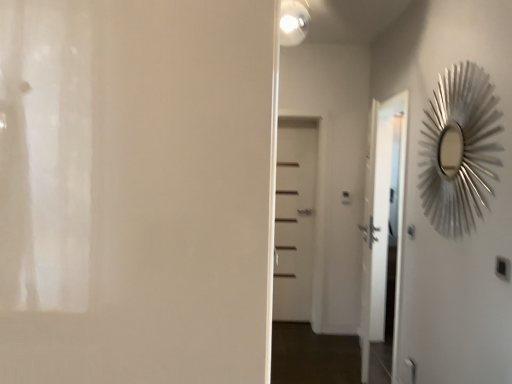
Locate an element on the screen. The height and width of the screenshot is (384, 512). white matte door at center, placed as the 1th door when sorted from right to left is located at coordinates (294, 219).

The width and height of the screenshot is (512, 384). Describe the element at coordinates (136, 190) in the screenshot. I see `white matte door at center, the second door viewed from the right` at that location.

Locate an element on the screen. The width and height of the screenshot is (512, 384). white glossy light fixture at upper center is located at coordinates (293, 22).

Where is `black plastic light switch at lower right`? black plastic light switch at lower right is located at coordinates (502, 268).

Can you confirm if silver metallic sunburst mirror at upper right is taller than white matte door at center, the first door positioned from the back?

No, silver metallic sunburst mirror at upper right is not taller than white matte door at center, the first door positioned from the back.

Could you tell me if silver metallic sunburst mirror at upper right is turned towards white matte door at center, which is counted as the 2th door, starting from the left?

No, silver metallic sunburst mirror at upper right is not oriented towards white matte door at center, which is counted as the 2th door, starting from the left.

Would you consider silver metallic sunburst mirror at upper right to be distant from white matte door at center, placed as the 1th door when sorted from right to left?

Indeed, silver metallic sunburst mirror at upper right is not near white matte door at center, placed as the 1th door when sorted from right to left.

Choose the correct answer: Is silver metallic sunburst mirror at upper right inside white matte door at center, which is counted as the 2th door, starting from the left, or outside it?

silver metallic sunburst mirror at upper right is spatially situated outside white matte door at center, which is counted as the 2th door, starting from the left.

Is silver metallic sunburst mirror at upper right outside of silver metallic sunburst mirror at right?

silver metallic sunburst mirror at upper right lies outside silver metallic sunburst mirror at right's area.

Is silver metallic sunburst mirror at upper right smaller than silver metallic sunburst mirror at right?

Correct, silver metallic sunburst mirror at upper right occupies less space than silver metallic sunburst mirror at right.

Is point (467, 209) farther from camera compared to point (369, 273)?

No.

Is silver metallic sunburst mirror at upper right next to silver metallic sunburst mirror at right?

No, silver metallic sunburst mirror at upper right is not with silver metallic sunburst mirror at right.

Considering the relative sizes of black plastic light switch at lower right and white glossy light fixture at upper center in the image provided, is black plastic light switch at lower right bigger than white glossy light fixture at upper center?

No.

Is point (498, 274) positioned in front of point (293, 21)?

Yes.

Is black plastic light switch at lower right next to white glossy light fixture at upper center and touching it?

No, black plastic light switch at lower right is not next to white glossy light fixture at upper center.

Is black plastic light switch at lower right turned away from white glossy light fixture at upper center?

black plastic light switch at lower right is not turned away from white glossy light fixture at upper center.

Is silver metallic sunburst mirror at upper right thinner than black plastic light switch at lower right?

No, silver metallic sunburst mirror at upper right is not thinner than black plastic light switch at lower right.

Is silver metallic sunburst mirror at upper right bigger than black plastic light switch at lower right?

Correct, silver metallic sunburst mirror at upper right is larger in size than black plastic light switch at lower right.

From a real-world perspective, is silver metallic sunburst mirror at upper right beneath black plastic light switch at lower right?

No, from a real-world perspective, silver metallic sunburst mirror at upper right is not below black plastic light switch at lower right.

Starting from the silver metallic sunburst mirror at upper right, which door is the 2nd one to the left? Please provide its 2D coordinates.

[(136, 190)]

Measure the distance from silver metallic sunburst mirror at upper right to white matte door at center, positioned as the 2th door in back-to-front order.

6.69 feet.

Which is closer, (x=450, y=117) or (x=166, y=162)?

Point (x=450, y=117) is positioned farther from the camera compared to point (x=166, y=162).

From the image's perspective, between silver metallic sunburst mirror at upper right and white matte door at center, positioned as the 1th door in front-to-back order, who is located below?

white matte door at center, positioned as the 1th door in front-to-back order, from the image's perspective.

Is white matte door at center, the first door positioned from the back, inside the boundaries of white glossy light fixture at upper center, or outside?

white matte door at center, the first door positioned from the back, cannot be found inside white glossy light fixture at upper center.

Considering the relative sizes of white matte door at center, which is counted as the 2th door, starting from the left, and white glossy light fixture at upper center in the image provided, is white matte door at center, which is counted as the 2th door, starting from the left, thinner than white glossy light fixture at upper center?

Indeed, white matte door at center, which is counted as the 2th door, starting from the left, has a lesser width compared to white glossy light fixture at upper center.

Between white matte door at center, placed as the 1th door when sorted from right to left, and white glossy light fixture at upper center, which one appears on the right side from the viewer's perspective?

white matte door at center, placed as the 1th door when sorted from right to left, is more to the right.

Who is shorter, white matte door at center, placed as the 1th door when sorted from right to left, or white glossy light fixture at upper center?

With less height is white glossy light fixture at upper center.

How much distance is there between silver metallic sunburst mirror at right and silver metallic sunburst mirror at upper right?

silver metallic sunburst mirror at right and silver metallic sunburst mirror at upper right are 33.87 inches apart from each other.

How many degrees apart are the facing directions of silver metallic sunburst mirror at right and silver metallic sunburst mirror at upper right?

They differ by 0.00226 degrees in their facing directions.

Considering the relative positions of silver metallic sunburst mirror at right and silver metallic sunburst mirror at upper right in the image provided, is silver metallic sunburst mirror at right in front of silver metallic sunburst mirror at upper right?

No, it is not.

Could you tell me if silver metallic sunburst mirror at right is facing silver metallic sunburst mirror at upper right?

No.

Find the location of a particular element. The width and height of the screenshot is (512, 384). reflection above the white matte door at center, arranged as the second door when viewed from the front (from the image's perspective) is located at coordinates (458, 149).

The width and height of the screenshot is (512, 384). Find the location of `screen door behind the silver metallic sunburst mirror at upper right`. screen door behind the silver metallic sunburst mirror at upper right is located at coordinates click(382, 217).

Based on their spatial positions, is black plastic light switch at lower right or white matte door at center, positioned as the 2th door in back-to-front order, further from silver metallic sunburst mirror at upper right?

white matte door at center, positioned as the 2th door in back-to-front order, is positioned further to the anchor silver metallic sunburst mirror at upper right.

Which object lies further to the anchor point white matte door at center, arranged as the second door when viewed from the front, black plastic light switch at lower right or silver metallic sunburst mirror at upper right?

black plastic light switch at lower right is further to white matte door at center, arranged as the second door when viewed from the front.

Looking at the image, which one is located closer to silver metallic sunburst mirror at upper right, black plastic light switch at lower right or silver metallic sunburst mirror at right?

Based on the image, black plastic light switch at lower right appears to be nearer to silver metallic sunburst mirror at upper right.

Looking at the image, which one is located further to silver metallic sunburst mirror at right, silver metallic sunburst mirror at upper right or white matte door at center, which is counted as the 2th door, starting from the left?

Among the two, silver metallic sunburst mirror at upper right is located further to silver metallic sunburst mirror at right.

Considering their positions, is white matte door at center, positioned as the 2th door in back-to-front order, positioned further to silver metallic sunburst mirror at upper right than silver metallic sunburst mirror at right?

→ white matte door at center, positioned as the 2th door in back-to-front order, is positioned further to the anchor silver metallic sunburst mirror at upper right.

From the image, which object appears to be nearer to white matte door at center, arranged as the second door when viewed from the front, white matte door at center, the second door viewed from the right, or white glossy light fixture at upper center?

white glossy light fixture at upper center is closer to white matte door at center, arranged as the second door when viewed from the front.

When comparing their distances from white matte door at center, positioned as the 1th door in front-to-back order, does silver metallic sunburst mirror at upper right or white glossy light fixture at upper center seem closer?

silver metallic sunburst mirror at upper right is closer to white matte door at center, positioned as the 1th door in front-to-back order.

From the image, which object appears to be nearer to white glossy light fixture at upper center, black plastic light switch at lower right or silver metallic sunburst mirror at right?

Based on the image, silver metallic sunburst mirror at right appears to be nearer to white glossy light fixture at upper center.

The height and width of the screenshot is (384, 512). In order to click on reflection between white matte door at center, positioned as the 2th door in back-to-front order, and white glossy light fixture at upper center, along the z-axis in this screenshot , I will do `click(458, 149)`.

Image resolution: width=512 pixels, height=384 pixels. Identify the location of reflection positioned between black plastic light switch at lower right and silver metallic sunburst mirror at right from near to far. click(458, 149).

I want to click on light fixture positioned between silver metallic sunburst mirror at upper right and white matte door at center, the first door positioned from the back, from near to far, so click(293, 22).

In order to click on light fixture positioned between black plastic light switch at lower right and white matte door at center, which is counted as the 2th door, starting from the left, from near to far in this screenshot , I will do `click(293, 22)`.